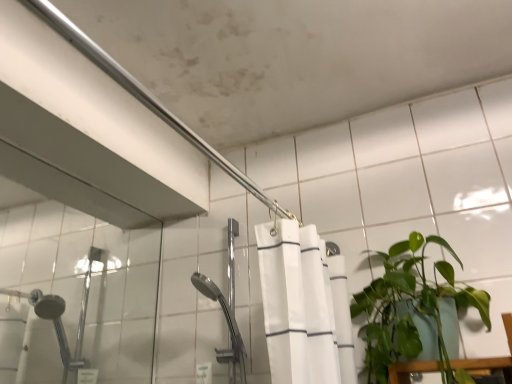
You are a GUI agent. You are given a task and a screenshot of the screen. Output one action in this format:
    pyautogui.click(x=<x>, y=<y>)
    Task: Click on the brushed metal shower at upper center
    
    Given the screenshot: What is the action you would take?
    pyautogui.click(x=144, y=95)

The width and height of the screenshot is (512, 384). Describe the element at coordinates (144, 95) in the screenshot. I see `brushed metal shower at upper center` at that location.

Identify the location of brushed metal shower at upper center. This screenshot has width=512, height=384. (144, 95).